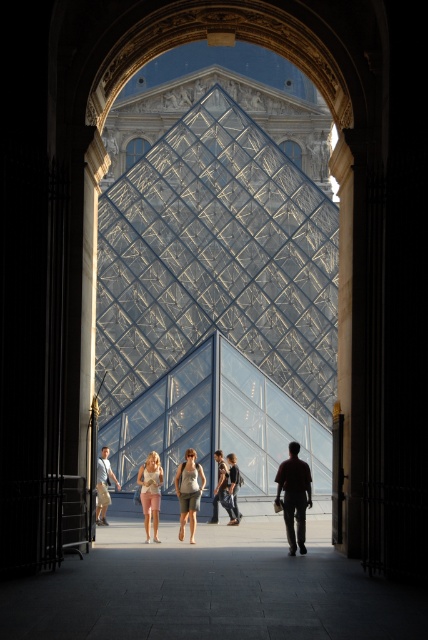
Is light beige shorts at center below dark blue jeans at center?

No.

Which of these two, light beige shorts at center or dark blue jeans at center, stands taller?

With more height is light beige shorts at center.

Is point (101, 488) positioned before point (238, 513)?

That is True.

Identify the location of light beige shorts at center. The image size is (428, 640). (104, 484).

Between white marble pillar at right and dark blue jeans at center, which one has less height?

dark blue jeans at center is shorter.

Does white marble pillar at right have a smaller size compared to dark blue jeans at center?

Actually, white marble pillar at right might be larger than dark blue jeans at center.

Identify the location of white marble pillar at right. The height and width of the screenshot is (640, 428). (344, 289).

Is matte gray shorts at center to the left of light beige shorts at center from the viewer's perspective?

In fact, matte gray shorts at center is to the right of light beige shorts at center.

Measure the distance between matte gray shorts at center and light beige shorts at center.

10.65 meters

Which is behind, point (193, 456) or point (104, 474)?

The point (104, 474) is behind.

This screenshot has width=428, height=640. I want to click on matte gray shorts at center, so click(x=189, y=492).